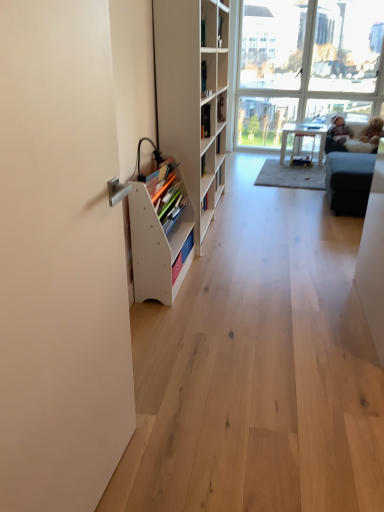
Where is `vacant space to the right of white matte bookshelf at left, the 1th shelf in the top-to-bottom sequence`? vacant space to the right of white matte bookshelf at left, the 1th shelf in the top-to-bottom sequence is located at coordinates (300, 226).